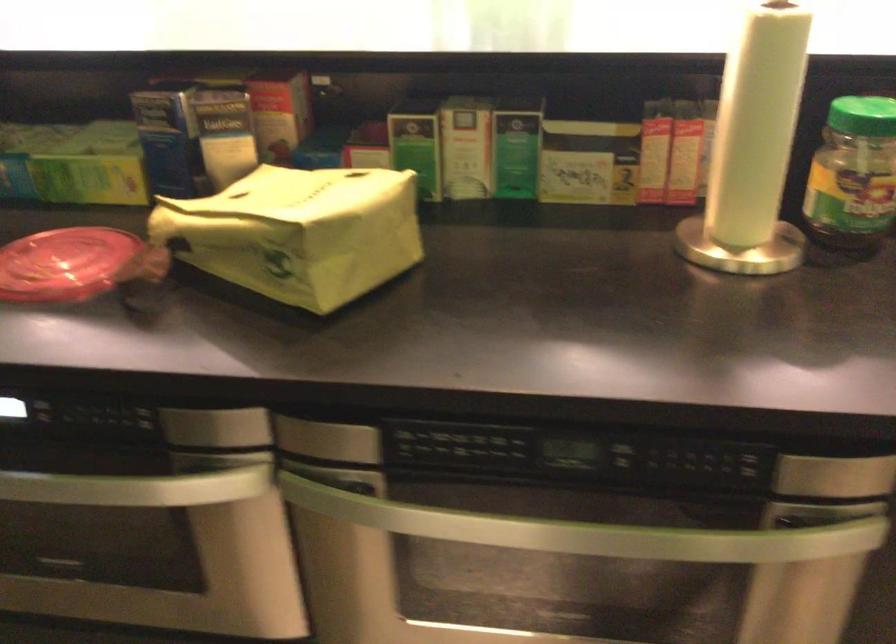
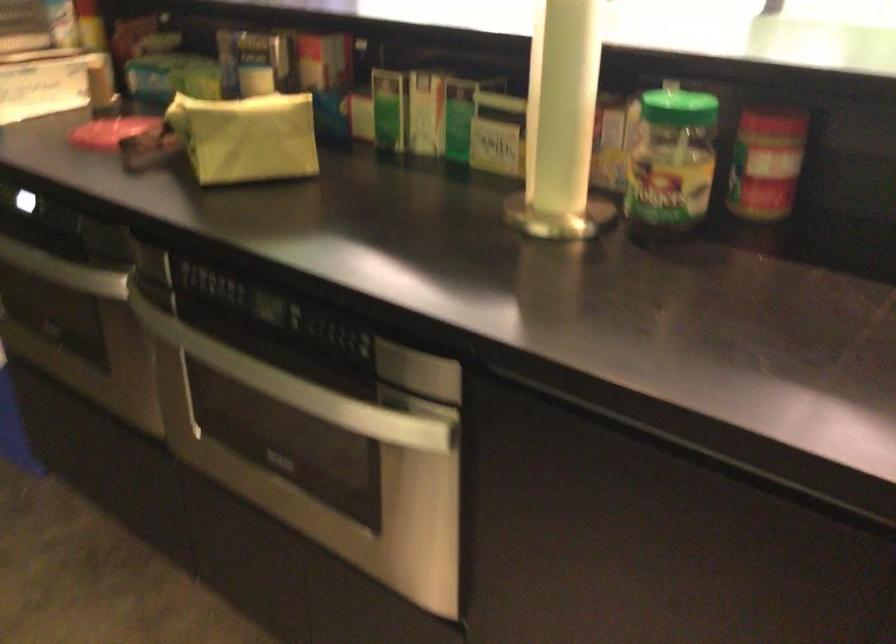
Find the pixel in the second image that matches pixel 771 128 in the first image.

(563, 102)